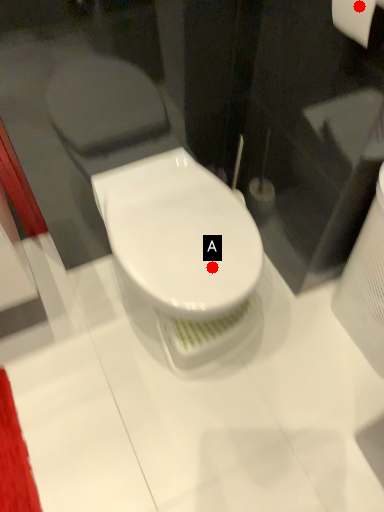
Question: Two points are circled on the image, labeled by A and B beside each circle. Which point is closer to the camera taking this photo?

Choices:
 (A) A is closer
 (B) B is closer

Answer: (B)